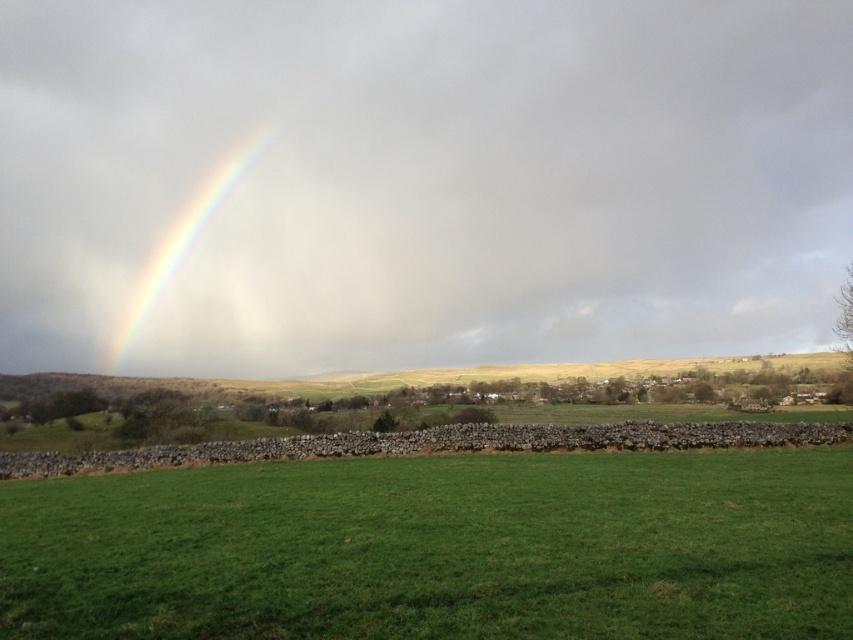
Between point (618, 552) and point (175, 227), which one is positioned behind?

Positioned behind is point (175, 227).

In the scene shown: Which of these two, green grass at center or rainbow at upper left, stands taller?

With more height is rainbow at upper left.

Find the location of a particular element. The width and height of the screenshot is (853, 640). green grass at center is located at coordinates (437, 548).